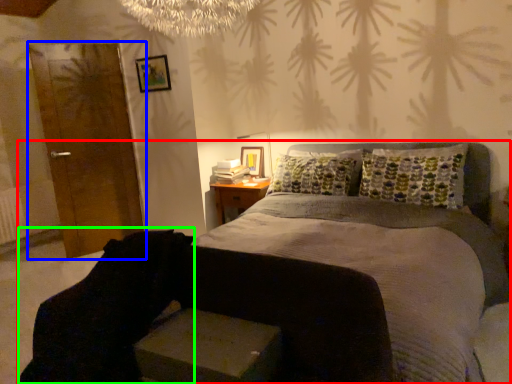
Question: Estimate the real-world distances between objects in this image. Which object is closer to bed (highlighted by a red box), armoire (highlighted by a blue box) or swivel chair (highlighted by a green box)?

Choices:
 (A) armoire
 (B) swivel chair

Answer: (B)